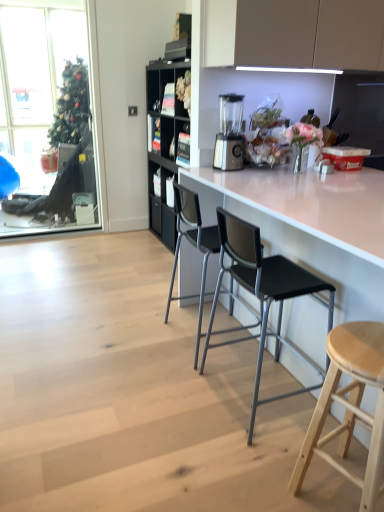
Locate an element on the screen. This screenshot has height=512, width=384. vacant space positioned to the left of light wood stool at lower right is located at coordinates pos(242,472).